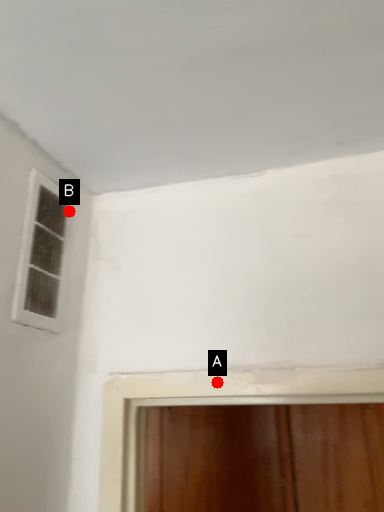
Question: Two points are circled on the image, labeled by A and B beside each circle. Which of the following is the farthest from the observer?

Choices:
 (A) A is further
 (B) B is further

Answer: (B)